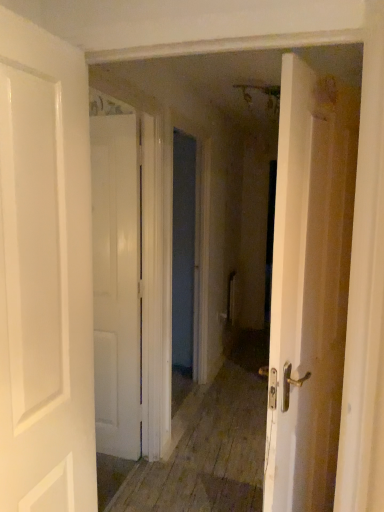
Question: Is white matte door at center, the first door positioned from the back, far away from white glossy door at left, which appears as the first door when viewed from the front?

Choices:
 (A) no
 (B) yes

Answer: (B)

Question: Is white matte door at center, which ranks as the 2th door in front-to-back order, further to camera compared to white glossy door at left, which appears as the first door when viewed from the front?

Choices:
 (A) yes
 (B) no

Answer: (A)

Question: Is white matte door at center, the first door positioned from the back, touching white glossy door at left, arranged as the 2th door when viewed from the back?

Choices:
 (A) yes
 (B) no

Answer: (B)

Question: Does white matte door at center, which ranks as the 2th door in front-to-back order, appear on the right side of white glossy door at left, arranged as the 2th door when viewed from the back?

Choices:
 (A) no
 (B) yes

Answer: (B)

Question: Is white glossy door at left, which appears as the first door when viewed from the front, at the back of white matte door at center, the first door positioned from the back?

Choices:
 (A) yes
 (B) no

Answer: (B)

Question: Does white matte door at center, which ranks as the 2th door in front-to-back order, have a larger size compared to white glossy door at left, which appears as the first door when viewed from the front?

Choices:
 (A) yes
 (B) no

Answer: (B)

Question: Does white glossy door at left, which appears as the first door when viewed from the front, have a greater width compared to white matte door at center, the first door positioned from the back?

Choices:
 (A) yes
 (B) no

Answer: (A)

Question: Can you confirm if white glossy door at left, arranged as the 2th door when viewed from the back, is shorter than white matte door at center, the first door positioned from the back?

Choices:
 (A) yes
 (B) no

Answer: (A)

Question: From the image's perspective, is white glossy door at left, arranged as the 2th door when viewed from the back, under white matte door at center, the first door positioned from the back?

Choices:
 (A) yes
 (B) no

Answer: (B)

Question: Considering the relative sizes of white glossy door at left, arranged as the 2th door when viewed from the back, and white matte door at center, which ranks as the 2th door in front-to-back order, in the image provided, is white glossy door at left, arranged as the 2th door when viewed from the back, thinner than white matte door at center, which ranks as the 2th door in front-to-back order,?

Choices:
 (A) yes
 (B) no

Answer: (B)

Question: Is white glossy door at left, arranged as the 2th door when viewed from the back, to the right of white matte door at center, which ranks as the 2th door in front-to-back order, from the viewer's perspective?

Choices:
 (A) no
 (B) yes

Answer: (A)

Question: Is the position of white glossy door at left, arranged as the 2th door when viewed from the back, more distant than that of white matte door at center, which ranks as the 2th door in front-to-back order?

Choices:
 (A) no
 (B) yes

Answer: (A)

Question: From a real-world perspective, relative to white matte door at center, the first door positioned from the back, is white glossy door at left, which appears as the first door when viewed from the front, vertically above or below?

Choices:
 (A) above
 (B) below

Answer: (A)